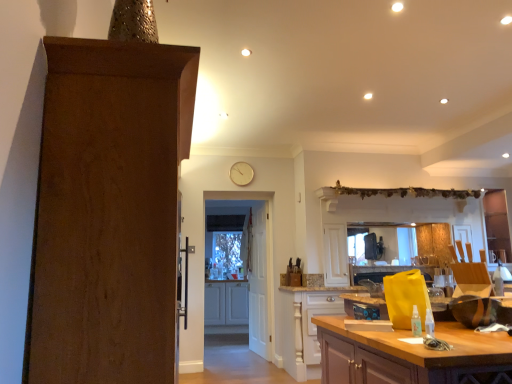
Question: Is the position of light brown wood cabinet at center, placed as the 2th cabinetry when sorted from left to right, more distant than that of white wooden door at center, the 1th door in the back-to-front sequence?

Choices:
 (A) yes
 (B) no

Answer: (B)

Question: Is light brown wood cabinet at center, positioned as the second cabinetry in back-to-front order, next to white wooden door at center, the 1th door in the back-to-front sequence, and touching it?

Choices:
 (A) yes
 (B) no

Answer: (B)

Question: From a real-world perspective, is light brown wood cabinet at center, the 2th cabinetry when ordered from right to left, beneath white wooden door at center, the third door positioned from the front?

Choices:
 (A) no
 (B) yes

Answer: (B)

Question: Can you confirm if light brown wood cabinet at center, which is the 2th cabinetry from front to back, is wider than white wooden door at center, the 1th door in the back-to-front sequence?

Choices:
 (A) yes
 (B) no

Answer: (A)

Question: Is light brown wood cabinet at center, placed as the 2th cabinetry when sorted from left to right, taller than white wooden door at center, the 1th door in the back-to-front sequence?

Choices:
 (A) yes
 (B) no

Answer: (B)

Question: Can you confirm if light brown wood cabinet at center, placed as the 2th cabinetry when sorted from left to right, is smaller than white wooden door at center, the third door positioned from the front?

Choices:
 (A) no
 (B) yes

Answer: (A)

Question: From a real-world perspective, is light brown wood cabinet at center, positioned as the second cabinetry in back-to-front order, beneath brown wood door at left, the 1th door viewed from the front?

Choices:
 (A) no
 (B) yes

Answer: (B)

Question: Is light brown wood cabinet at center, the 2th cabinetry when ordered from right to left, bigger than brown wood door at left, the third door when ordered from back to front?

Choices:
 (A) yes
 (B) no

Answer: (B)

Question: Considering the relative positions of light brown wood cabinet at center, which is the 2th cabinetry from front to back, and brown wood door at left, the 1th door viewed from the front, in the image provided, is light brown wood cabinet at center, which is the 2th cabinetry from front to back, to the left of brown wood door at left, the 1th door viewed from the front, from the viewer's perspective?

Choices:
 (A) no
 (B) yes

Answer: (A)

Question: Does light brown wood cabinet at center, positioned as the second cabinetry in back-to-front order, appear on the right side of brown wood door at left, the third door when ordered from back to front?

Choices:
 (A) no
 (B) yes

Answer: (B)

Question: From the image's perspective, does light brown wood cabinet at center, placed as the 2th cabinetry when sorted from left to right, appear lower than brown wood door at left, the third door when ordered from back to front?

Choices:
 (A) yes
 (B) no

Answer: (A)

Question: Is light brown wood cabinet at center, placed as the 2th cabinetry when sorted from left to right, outside brown wood door at left, the third door when ordered from back to front?

Choices:
 (A) no
 (B) yes

Answer: (B)

Question: Is white wooden door at center, the 1th door in the back-to-front sequence, closer to camera compared to gold metallic clock at upper center?

Choices:
 (A) yes
 (B) no

Answer: (B)